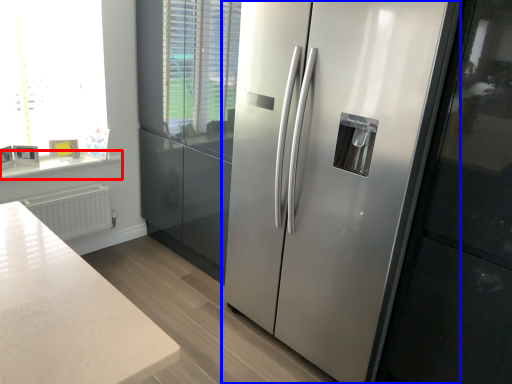
Question: Which of the following is the farthest to the observer, counter top (highlighted by a red box) or refrigerator (highlighted by a blue box)?

Choices:
 (A) counter top
 (B) refrigerator

Answer: (A)